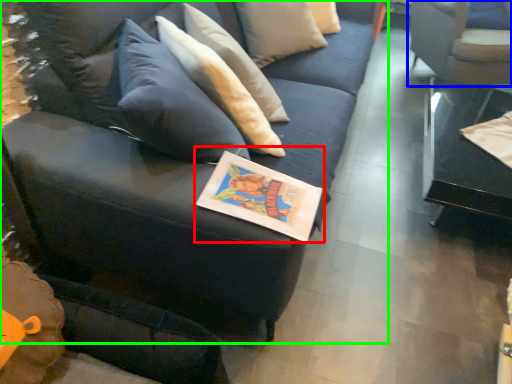
Question: Based on their relative distances, which object is nearer to book (highlighted by a red box)? Choose from chair (highlighted by a blue box) and studio couch (highlighted by a green box).

Choices:
 (A) chair
 (B) studio couch

Answer: (B)